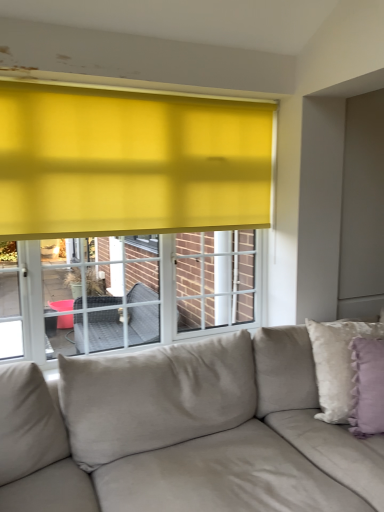
Question: Does lavender velvet pillow at right, which appears as the 1th pillow when viewed from the front, have a larger size compared to suede-like beige couch at lower center?

Choices:
 (A) yes
 (B) no

Answer: (B)

Question: Is lavender velvet pillow at right, which appears as the 1th pillow when viewed from the front, located outside suede-like beige couch at lower center?

Choices:
 (A) no
 (B) yes

Answer: (A)

Question: Does lavender velvet pillow at right, placed as the 2th pillow when sorted from back to front, have a lesser height compared to suede-like beige couch at lower center?

Choices:
 (A) no
 (B) yes

Answer: (B)

Question: Can you confirm if lavender velvet pillow at right, placed as the 2th pillow when sorted from back to front, is smaller than suede-like beige couch at lower center?

Choices:
 (A) yes
 (B) no

Answer: (A)

Question: Is lavender velvet pillow at right, which appears as the 1th pillow when viewed from the front, directly adjacent to suede-like beige couch at lower center?

Choices:
 (A) no
 (B) yes

Answer: (A)

Question: From a real-world perspective, is fluffy white pillow at right, which ranks as the 2th pillow in front-to-back order, above or below suede-like beige couch at lower center?

Choices:
 (A) below
 (B) above

Answer: (B)

Question: Considering the positions of fluffy white pillow at right, the 1th pillow positioned from the back, and suede-like beige couch at lower center in the image, is fluffy white pillow at right, the 1th pillow positioned from the back, bigger or smaller than suede-like beige couch at lower center?

Choices:
 (A) small
 (B) big

Answer: (A)

Question: From the image's perspective, is fluffy white pillow at right, which ranks as the 2th pillow in front-to-back order, located above or below suede-like beige couch at lower center?

Choices:
 (A) below
 (B) above

Answer: (B)

Question: Considering the positions of fluffy white pillow at right, the 1th pillow positioned from the back, and suede-like beige couch at lower center in the image, is fluffy white pillow at right, the 1th pillow positioned from the back, wider or thinner than suede-like beige couch at lower center?

Choices:
 (A) thin
 (B) wide

Answer: (A)

Question: In terms of size, does suede-like beige couch at lower center appear bigger or smaller than fluffy white pillow at right, which ranks as the 2th pillow in front-to-back order?

Choices:
 (A) small
 (B) big

Answer: (B)

Question: From their relative heights in the image, would you say suede-like beige couch at lower center is taller or shorter than fluffy white pillow at right, the 1th pillow positioned from the back?

Choices:
 (A) tall
 (B) short

Answer: (A)

Question: In terms of width, does suede-like beige couch at lower center look wider or thinner when compared to fluffy white pillow at right, the 1th pillow positioned from the back?

Choices:
 (A) wide
 (B) thin

Answer: (A)

Question: From the image's perspective, is suede-like beige couch at lower center located above or below fluffy white pillow at right, the 1th pillow positioned from the back?

Choices:
 (A) above
 (B) below

Answer: (B)

Question: Considering the positions of fluffy white pillow at right, which ranks as the 2th pillow in front-to-back order, and lavender velvet pillow at right, placed as the 2th pillow when sorted from back to front, in the image, is fluffy white pillow at right, which ranks as the 2th pillow in front-to-back order, taller or shorter than lavender velvet pillow at right, placed as the 2th pillow when sorted from back to front,?

Choices:
 (A) tall
 (B) short

Answer: (A)

Question: From the image's perspective, is fluffy white pillow at right, the 1th pillow positioned from the back, above or below lavender velvet pillow at right, placed as the 2th pillow when sorted from back to front?

Choices:
 (A) below
 (B) above

Answer: (B)